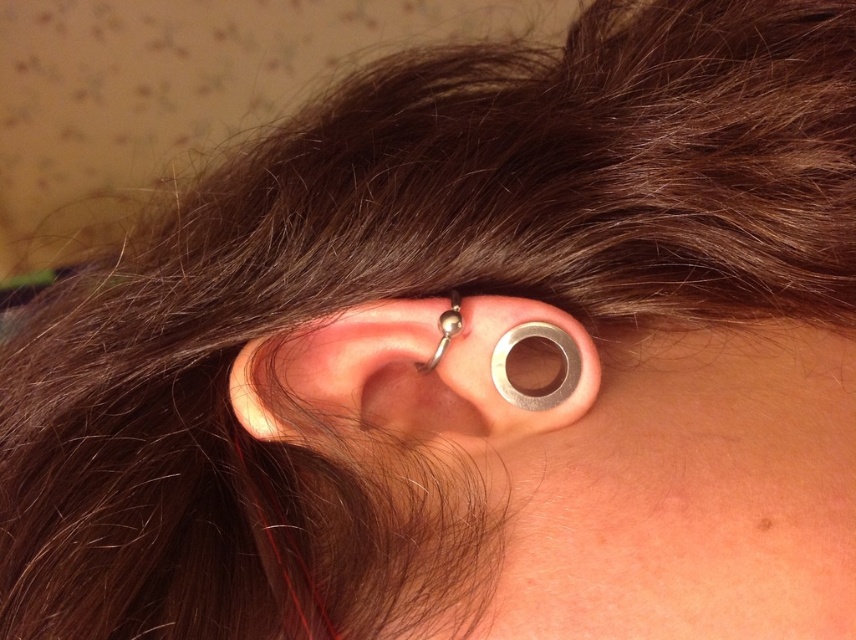
In the scene shown: You are a jeweler examining the ear piercings. You need to determine the order of the silver metallic ring at center and the polished silver ball at center from the front view. Which one is closer to the observer?

The polished silver ball at center is closer to the observer because the silver metallic ring at center is positioned under it.

From the picture: Based on the scene description, what object is located at the coordinates point (417, 372)?

The point (417, 372) corresponds to the silver metallic ring at center.